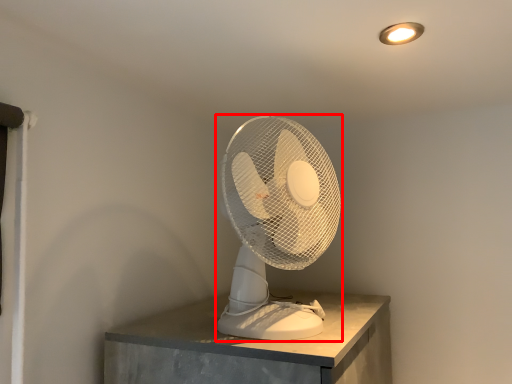
Question: From the image, what is the correct spatial relationship of mechanical fan (annotated by the red box) in relation to lamp?

Choices:
 (A) left
 (B) right

Answer: (A)